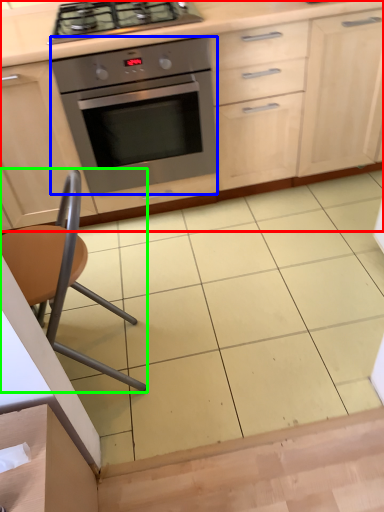
Question: Which is nearer to the cabinetry (highlighted by a red box)? oven (highlighted by a blue box) or chair (highlighted by a green box).

Choices:
 (A) oven
 (B) chair

Answer: (A)